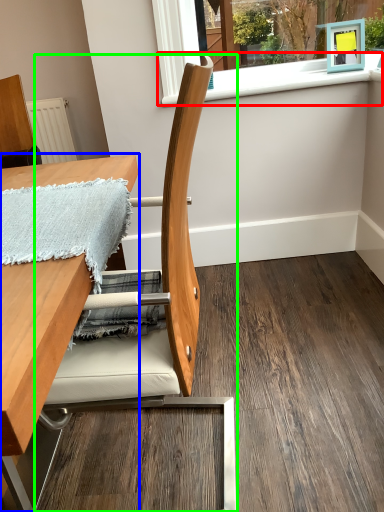
Question: Estimate the real-world distances between objects in this image. Which object is closer to window sill (highlighted by a red box), table (highlighted by a blue box) or chair (highlighted by a green box)?

Choices:
 (A) table
 (B) chair

Answer: (A)